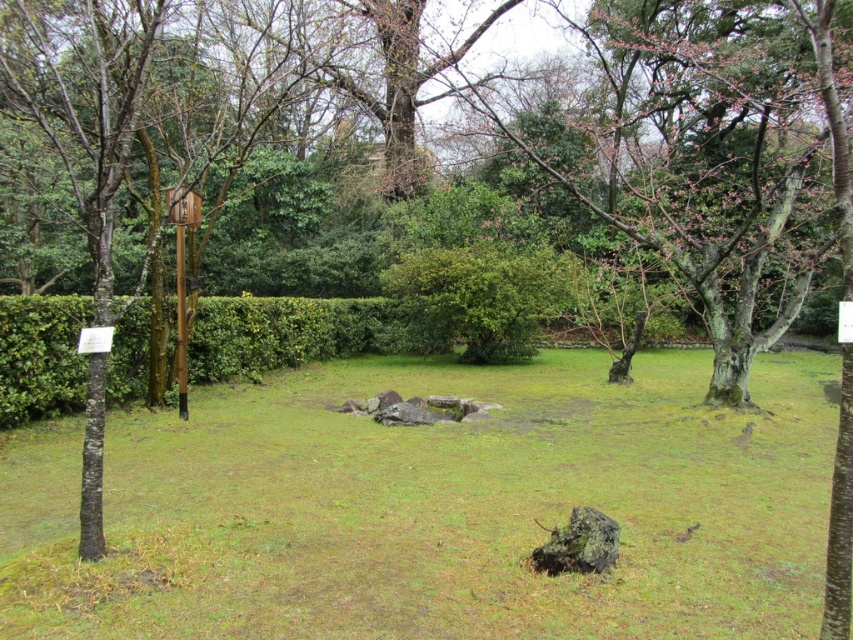
Is green grass at center shorter than green leafy bush at center?

Indeed, green grass at center has a lesser height compared to green leafy bush at center.

Is the position of green grass at center more distant than that of green leafy bush at center?

No, it is not.

Is point (55, 621) farther from viewer compared to point (569, 300)?

That is False.

Find the location of `green grass at center`. green grass at center is located at coordinates (433, 508).

Who is more distant from viewer, [392,340] or [461,356]?

Positioned behind is point [392,340].

Does green leafy hedge at center appear on the left side of green leafy bush at center?

Correct, you'll find green leafy hedge at center to the left of green leafy bush at center.

Image resolution: width=853 pixels, height=640 pixels. Identify the location of green leafy hedge at center. (288, 333).

Is green grass at center shorter than green leafy hedge at center?

Yes.

Does green grass at center have a larger size compared to green leafy hedge at center?

No.

Who is more distant from viewer, (99, 627) or (65, 342)?

The point (65, 342) is more distant.

Identify the location of green grass at center. The height and width of the screenshot is (640, 853). (433, 508).